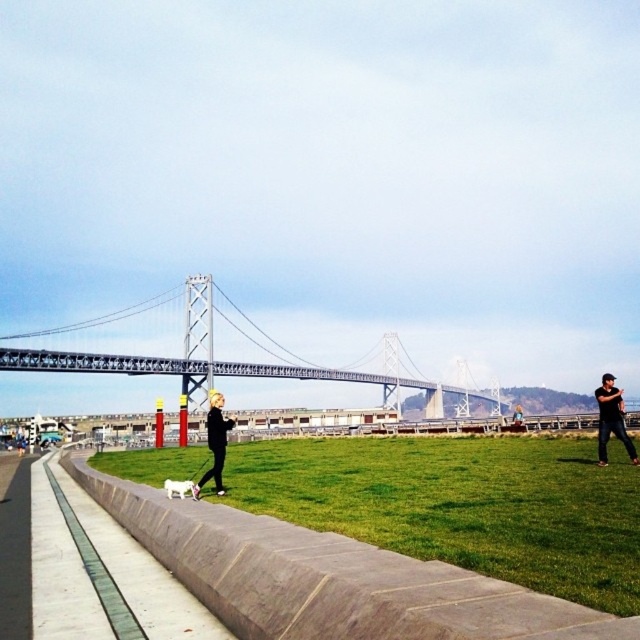
Image resolution: width=640 pixels, height=640 pixels. Find the location of `green grass at lower center`. green grass at lower center is located at coordinates (461, 504).

What do you see at coordinates (461, 504) in the screenshot? I see `green grass at lower center` at bounding box center [461, 504].

Between point (374, 481) and point (634, 460), which one is positioned in front?

Point (374, 481) is more forward.

Identify the location of green grass at lower center. The height and width of the screenshot is (640, 640). (461, 504).

Between point (618, 410) and point (177, 484), which one is positioned behind?

Point (618, 410)

Is the position of black matte person at right less distant than that of white fur dog at center?

No.

Between point (634, 456) and point (179, 497), which one is positioned behind?

Point (634, 456)

I want to click on black matte person at right, so click(x=611, y=419).

In the scene shown: Can you confirm if green grass at lower center is bigger than white fur dog at center?

Yes.

Can you confirm if green grass at lower center is positioned to the left of white fur dog at center?

Incorrect, green grass at lower center is not on the left side of white fur dog at center.

Locate an element on the screen. green grass at lower center is located at coordinates (461, 504).

Where is `green grass at lower center`? The height and width of the screenshot is (640, 640). green grass at lower center is located at coordinates (461, 504).